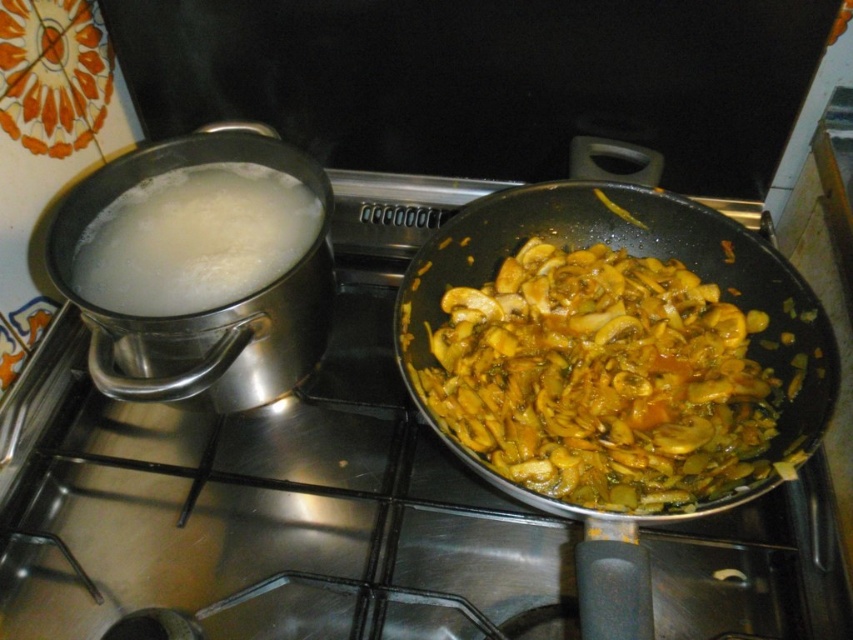
Question: Which is farther from the shiny black wok at center?

Choices:
 (A) white creamy liquid at left
 (B) yellowish-brown sautéed mushrooms at center-right

Answer: (A)

Question: Does shiny black wok at center have a larger size compared to white creamy liquid at left?

Choices:
 (A) no
 (B) yes

Answer: (B)

Question: Which point is farther from the camera taking this photo?

Choices:
 (A) (706, 246)
 (B) (254, 241)
 (C) (682, 356)

Answer: (A)

Question: Does yellowish-brown sautéed mushrooms at center-right appear on the left side of white creamy liquid at left?

Choices:
 (A) yes
 (B) no

Answer: (B)

Question: Estimate the real-world distances between objects in this image. Which object is farther from the yellowish-brown sautéed mushrooms at center-right?

Choices:
 (A) white creamy liquid at left
 (B) shiny black wok at center

Answer: (A)

Question: Can you confirm if yellowish-brown sautéed mushrooms at center-right is smaller than white creamy liquid at left?

Choices:
 (A) yes
 (B) no

Answer: (B)